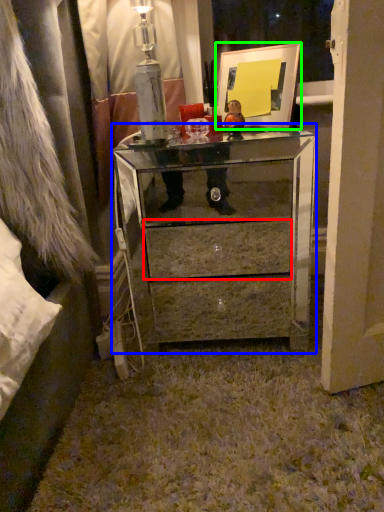
Question: Considering the real-world distances, which object is closest to drawer (highlighted by a red box)? chest of drawers (highlighted by a blue box) or picture frame (highlighted by a green box).

Choices:
 (A) chest of drawers
 (B) picture frame

Answer: (A)